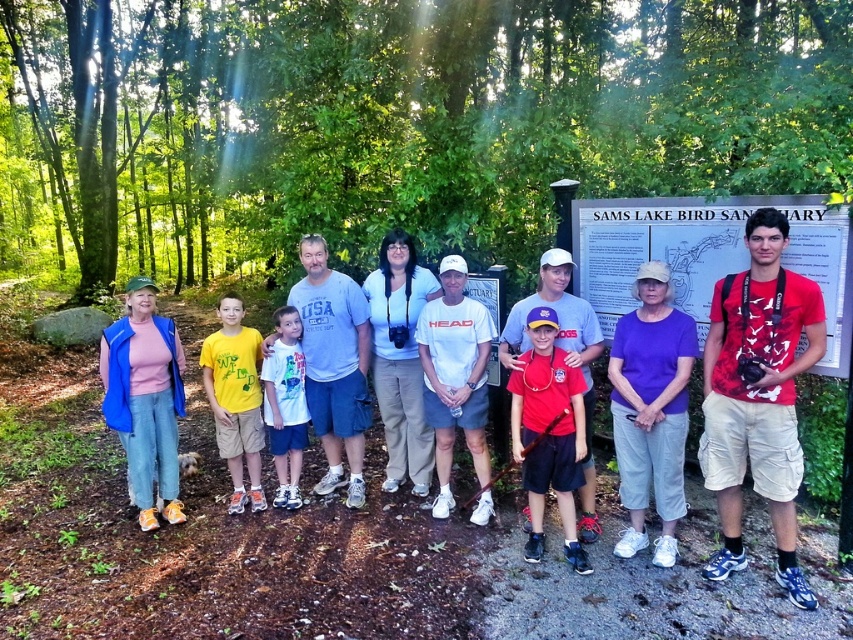
Question: Among these points, which one is farthest from the camera?

Choices:
 (A) (120, 26)
 (B) (223, 362)
 (C) (532, 451)
 (D) (289, 435)

Answer: (A)

Question: From the image, what is the correct spatial relationship of green leafy forest at upper center in relation to purple fabric cap at center?

Choices:
 (A) left
 (B) right

Answer: (A)

Question: Which point appears closest to the camera in this image?

Choices:
 (A) (277, 422)
 (B) (241, 396)
 (C) (134, 106)

Answer: (B)

Question: Considering the real-world distances, which object is closest to the white paper sign at center?

Choices:
 (A) matte blue jacket at center
 (B) purple fabric cap at center
 (C) yellow cotton shirt at center

Answer: (A)

Question: Does matte blue jacket at center have a smaller size compared to white paper sign at center?

Choices:
 (A) yes
 (B) no

Answer: (A)

Question: Does yellow cotton shirt at center have a larger size compared to white cotton shirt at center?

Choices:
 (A) no
 (B) yes

Answer: (B)